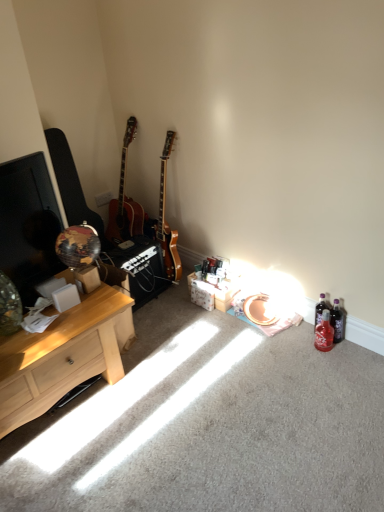
Question: Considering the positions of translucent plastic bottle at lower right, marked as the first bottle in a back-to-front arrangement, and matte black guitar at left in the image, is translucent plastic bottle at lower right, marked as the first bottle in a back-to-front arrangement, wider or thinner than matte black guitar at left?

Choices:
 (A) thin
 (B) wide

Answer: (A)

Question: Looking at the image, does translucent plastic bottle at lower right, marked as the first bottle in a back-to-front arrangement, seem bigger or smaller compared to matte black guitar at left?

Choices:
 (A) small
 (B) big

Answer: (A)

Question: Which object is positioned farthest from the matte black guitar at left?

Choices:
 (A) red glass bottle at lower right, which is the 2th bottle from back to front
 (B) light wood desk at left
 (C) translucent plastic bottle at lower right, marked as the first bottle in a back-to-front arrangement
 (D) white plastic power outlet at upper center

Answer: (A)

Question: Considering the real-world distances, which object is farthest from the red glass bottle at lower right, acting as the first bottle starting from the front?

Choices:
 (A) light wood desk at left
 (B) white plastic power outlet at upper center
 (C) matte black guitar at left
 (D) translucent plastic bottle at lower right, placed as the second bottle when sorted from front to back

Answer: (B)